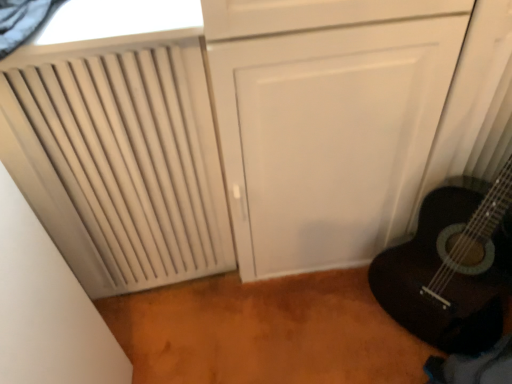
Question: Considering the relative sizes of beige matte radiator at left and white textured window at upper left in the image provided, is beige matte radiator at left shorter than white textured window at upper left?

Choices:
 (A) no
 (B) yes

Answer: (A)

Question: From a real-world perspective, is beige matte radiator at left over white textured window at upper left?

Choices:
 (A) no
 (B) yes

Answer: (A)

Question: From the image's perspective, is beige matte radiator at left on white textured window at upper left?

Choices:
 (A) no
 (B) yes

Answer: (A)

Question: From a real-world perspective, is beige matte radiator at left physically below white textured window at upper left?

Choices:
 (A) yes
 (B) no

Answer: (A)

Question: Is beige matte radiator at left facing away from white textured window at upper left?

Choices:
 (A) no
 (B) yes

Answer: (A)

Question: In terms of size, does black mesh curtain at upper left appear bigger or smaller than white textured window at upper left?

Choices:
 (A) small
 (B) big

Answer: (A)

Question: Choose the correct answer: Is black mesh curtain at upper left inside white textured window at upper left or outside it?

Choices:
 (A) outside
 (B) inside

Answer: (A)

Question: In the image, is black mesh curtain at upper left positioned in front of or behind white textured window at upper left?

Choices:
 (A) front
 (B) behind

Answer: (A)

Question: Considering the positions of black mesh curtain at upper left and white textured window at upper left in the image, is black mesh curtain at upper left wider or thinner than white textured window at upper left?

Choices:
 (A) thin
 (B) wide

Answer: (A)

Question: In terms of width, does beige matte radiator at left look wider or thinner when compared to white textured window at upper left?

Choices:
 (A) wide
 (B) thin

Answer: (B)

Question: Is beige matte radiator at left taller or shorter than white textured window at upper left?

Choices:
 (A) tall
 (B) short

Answer: (A)

Question: Considering their positions, is beige matte radiator at left located in front of or behind white textured window at upper left?

Choices:
 (A) front
 (B) behind

Answer: (A)

Question: Is point (92, 246) closer or farther from the camera than point (180, 4)?

Choices:
 (A) closer
 (B) farther

Answer: (B)

Question: Based on their sizes in the image, would you say black mesh curtain at upper left is bigger or smaller than beige matte radiator at left?

Choices:
 (A) small
 (B) big

Answer: (A)

Question: Considering the positions of point (40, 1) and point (144, 160), is point (40, 1) closer or farther from the camera than point (144, 160)?

Choices:
 (A) farther
 (B) closer

Answer: (B)